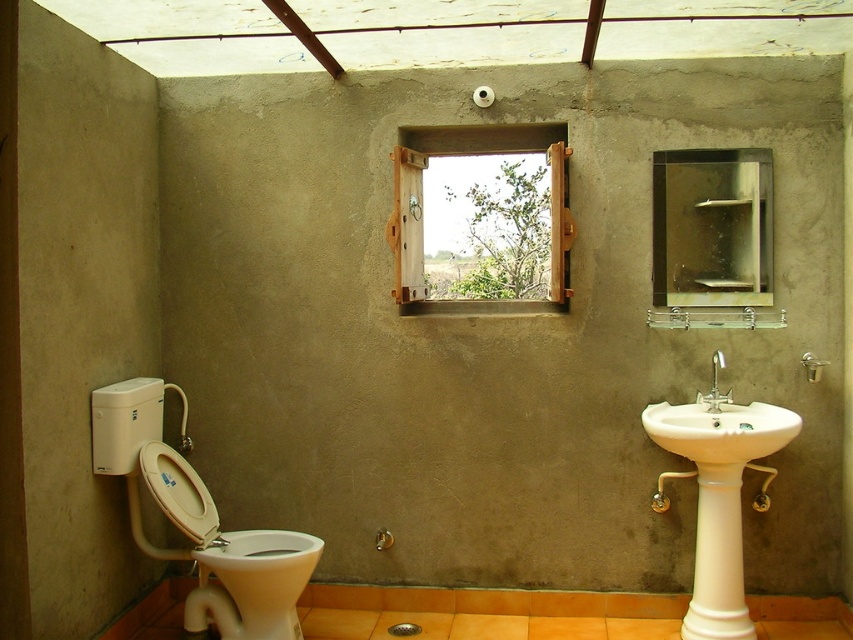
You are a maintenance worker who needs to clean the wooden frame at center and the white ceramic sink at right. You have a 35 inch long cleaning rod. Can you reach both objects with the same rod without moving your position? Please explain your reasoning.

The wooden frame at center and white ceramic sink at right are 35.73 inches apart. Since the distance between them is greater than the 35 inch length of the rod, you cannot reach both objects with the same rod without moving your position.

You are standing in the bathroom and want to check your appearance in the clear glass mirror at upper center before using the white glossy bidet at lower left. Which object should you approach first to do so?

The clear glass mirror at upper center is positioned on the right side of the white glossy bidet at lower left. To check your appearance before using the bidet, you should approach the clear glass mirror at upper center first.

You are standing in the bathroom and want to determine which of the two points, point (763, 241) or point (717, 396), is closer to you. Based on the spatial relationship between these points, which one is nearer?

Point (763, 241) is further to the camera than point (717, 396), so the point closer to you is point (717, 396).